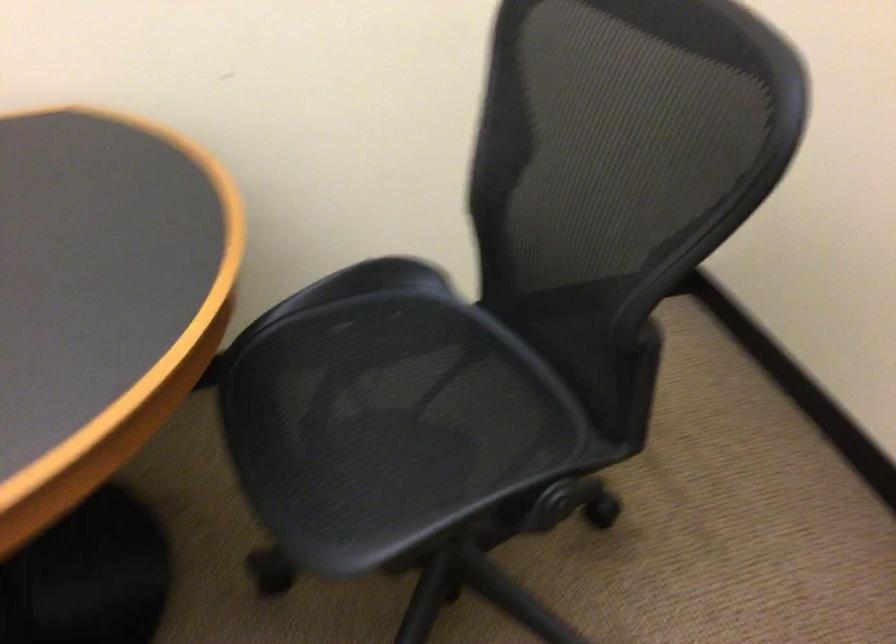
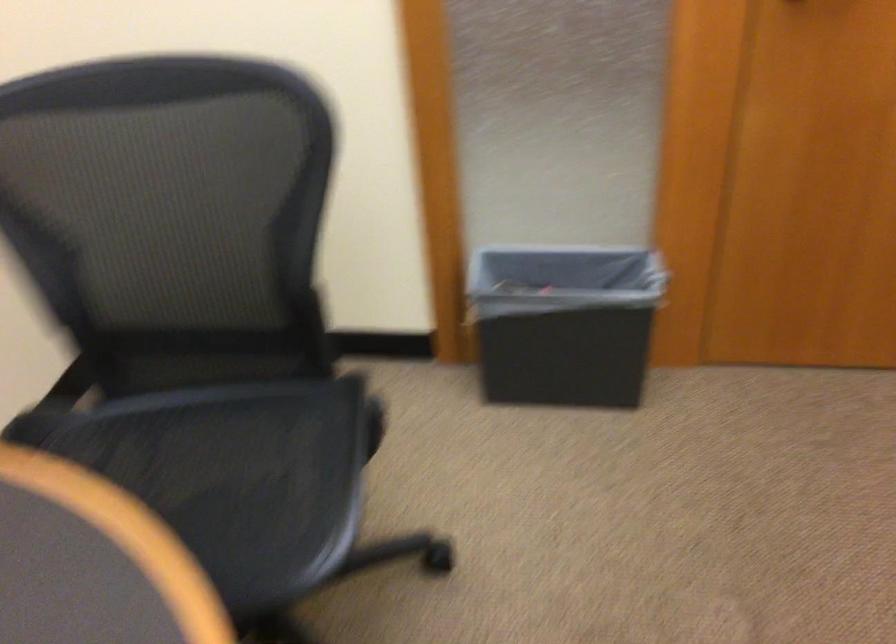
Question: The images are taken continuously from a first-person perspective. In which direction is your viewpoint rotating?

Choices:
 (A) Left
 (B) Right
 (C) Up
 (D) Down

Answer: (B)